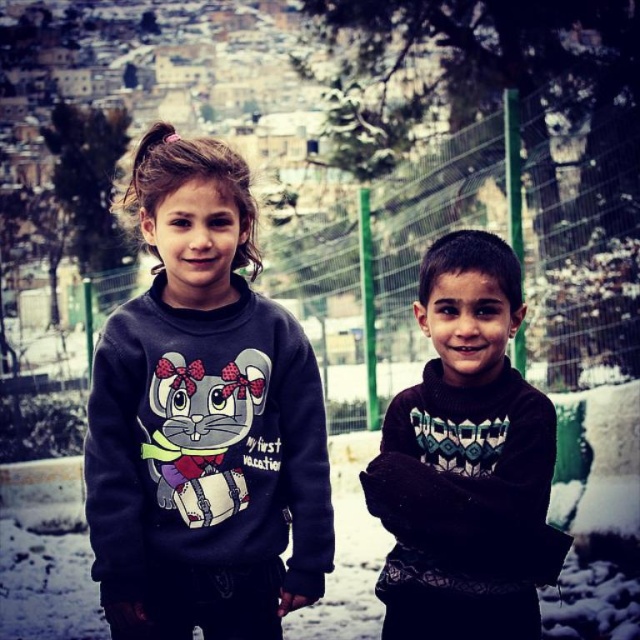
You are a photographer trying to capture the matte dark blue sweatshirt at center and the black knitted sweater at right. Based on their positions, which one is higher up in the image?

The matte dark blue sweatshirt at center is above the black knitted sweater at right, so it is higher up in the image.

You are a photographer trying to capture the point at coordinates (204, 420) in the image. Which object should you focus on to ensure the point is in the frame?

The point at coordinates (204, 420) is located on the matte dark blue sweatshirt at center, so you should focus on the matte dark blue sweatshirt at center to ensure the point is in the frame.

You are a photographer trying to capture both the matte dark blue sweatshirt at center and the black knitted sweater at right in a single frame. Given that the camera can only focus on objects within a 30 cm width range, can both be included without needing to adjust the camera settings?

The matte dark blue sweatshirt at center is wider than the black knitted sweater at right. However, since the camera can focus on objects within a 30 cm width range, both can be included as long as their combined width does not exceed 30 cm. The exact widths are not provided, so it depends on their actual measurements.